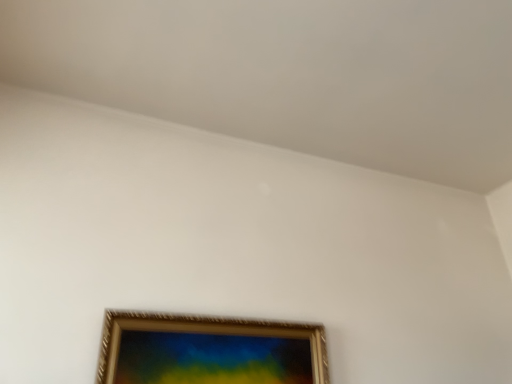
Where is `gold metallic picture frame at lower center`? This screenshot has height=384, width=512. gold metallic picture frame at lower center is located at coordinates (209, 350).

Describe the element at coordinates (209, 350) in the screenshot. I see `gold metallic picture frame at lower center` at that location.

What is the approximate height of gold metallic picture frame at lower center?

The height of gold metallic picture frame at lower center is 9.14 inches.

Locate an element on the screen. gold metallic picture frame at lower center is located at coordinates (209, 350).